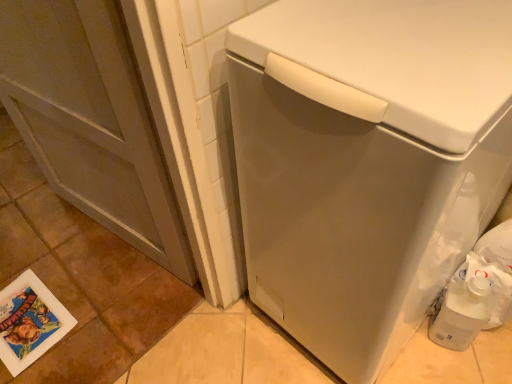
What do you see at coordinates (476, 292) in the screenshot? I see `white plastic jug at lower right` at bounding box center [476, 292].

Describe the element at coordinates (30, 321) in the screenshot. Image resolution: width=512 pixels, height=384 pixels. I see `printed paper postcard at lower left` at that location.

Describe the element at coordinates (90, 120) in the screenshot. I see `matte gray screen door at left` at that location.

Identify the location of white plastic jug at lower right. (476, 292).

Which object is closer to the camera taking this photo, printed paper postcard at lower left or matte gray screen door at left?

matte gray screen door at left is more forward.

Is printed paper postcard at lower left looking in the opposite direction of matte gray screen door at left?

No, printed paper postcard at lower left is not facing the opposite direction of matte gray screen door at left.

In the scene shown: Is matte gray screen door at left inside printed paper postcard at lower left?

Actually, matte gray screen door at left is outside printed paper postcard at lower left.

Is printed paper postcard at lower left to the right of matte gray screen door at left from the viewer's perspective?

Incorrect, printed paper postcard at lower left is not on the right side of matte gray screen door at left.

From a real-world perspective, is printed paper postcard at lower left physically located above or below white plastic jug at lower right?

In terms of real-world spatial position, printed paper postcard at lower left is below white plastic jug at lower right.

Looking at this image, from the image's perspective, which object appears higher, printed paper postcard at lower left or white plastic jug at lower right?

white plastic jug at lower right appears higher in the image.

Is there a large distance between printed paper postcard at lower left and white plastic jug at lower right?

Yes, printed paper postcard at lower left and white plastic jug at lower right are quite far apart.

From a real-world perspective, is white plastic jug at lower right physically below matte gray screen door at left?

Indeed, from a real-world perspective, white plastic jug at lower right is positioned beneath matte gray screen door at left.

Is white plastic jug at lower right aimed at matte gray screen door at left?

No, white plastic jug at lower right is not facing towards matte gray screen door at left.

Considering the relative positions of white plastic jug at lower right and matte gray screen door at left in the image provided, is white plastic jug at lower right to the right of matte gray screen door at left from the viewer's perspective?

Yes, white plastic jug at lower right is to the right of matte gray screen door at left.

From a real-world perspective, is matte gray screen door at left on top of white matte washing machine at center?

No, from a real-world perspective, matte gray screen door at left is not over white matte washing machine at center

From the image's perspective, is matte gray screen door at left under white matte washing machine at center?

Incorrect, from the image's perspective, matte gray screen door at left is higher than white matte washing machine at center.

How many degrees apart are the facing directions of matte gray screen door at left and white matte washing machine at center?

The angular difference between matte gray screen door at left and white matte washing machine at center is 7.58 degrees.

From a real-world perspective, is white plastic jug at lower right physically located above or below printed paper postcard at lower left?

From a real-world perspective, white plastic jug at lower right is physically above printed paper postcard at lower left.

How many degrees apart are the facing directions of white plastic jug at lower right and printed paper postcard at lower left?

The facing directions of white plastic jug at lower right and printed paper postcard at lower left are 4.24 degrees apart.

In the image, is white plastic jug at lower right on the left side or the right side of printed paper postcard at lower left?

In the image, white plastic jug at lower right appears on the right side of printed paper postcard at lower left.

Can printed paper postcard at lower left be found inside white plastic jug at lower right?

Definitely not — printed paper postcard at lower left is not inside white plastic jug at lower right.

From a real-world perspective, is matte gray screen door at left located higher than white plastic jug at lower right?

Correct, in the physical world, matte gray screen door at left is higher than white plastic jug at lower right.

In the scene shown: Is matte gray screen door at left wider than white plastic jug at lower right?

Yes.

Is matte gray screen door at left in contact with white plastic jug at lower right?

They are not placed beside each other.

Looking at this image, between matte gray screen door at left and white plastic jug at lower right, which one appears on the right side from the viewer's perspective?

white plastic jug at lower right.

Which of these two, white matte washing machine at center or printed paper postcard at lower left, stands shorter?

Standing shorter between the two is printed paper postcard at lower left.

Does white matte washing machine at center appear on the right side of printed paper postcard at lower left?

Yes, white matte washing machine at center is to the right of printed paper postcard at lower left.

Is white matte washing machine at center facing towards printed paper postcard at lower left?

No.

Locate an element on the screen. This screenshot has width=512, height=384. screen door that is in front of the printed paper postcard at lower left is located at coordinates (90, 120).

At what (x,y) coordinates should I click in order to perform the action: click on garbage on the right of printed paper postcard at lower left. Please return your answer as a coordinate pair (x, y). The image size is (512, 384). Looking at the image, I should click on (476, 292).

Estimate the real-world distances between objects in this image. Which object is closer to matte gray screen door at left, white matte washing machine at center or printed paper postcard at lower left?

white matte washing machine at center.

Looking at the image, which one is located closer to white plastic jug at lower right, printed paper postcard at lower left or matte gray screen door at left?

Among the two, matte gray screen door at left is located nearer to white plastic jug at lower right.

From the image, which object appears to be nearer to white plastic jug at lower right, white matte washing machine at center or matte gray screen door at left?

The object closer to white plastic jug at lower right is white matte washing machine at center.

When comparing their distances from printed paper postcard at lower left, does matte gray screen door at left or white matte washing machine at center seem closer?

matte gray screen door at left is positioned closer to the anchor printed paper postcard at lower left.

Based on the photo, when comparing their distances from printed paper postcard at lower left, does matte gray screen door at left or white plastic jug at lower right seem closer?

matte gray screen door at left.

When comparing their distances from matte gray screen door at left, does printed paper postcard at lower left or white matte washing machine at center seem closer?

white matte washing machine at center is closer to matte gray screen door at left.

Which object lies nearer to the anchor point matte gray screen door at left, white matte washing machine at center or white plastic jug at lower right?

Based on the image, white matte washing machine at center appears to be nearer to matte gray screen door at left.

Estimate the real-world distances between objects in this image. Which object is closer to white matte washing machine at center, printed paper postcard at lower left or white plastic jug at lower right?

white plastic jug at lower right.

This screenshot has height=384, width=512. Identify the location of screen door between printed paper postcard at lower left and white matte washing machine at center from left to right. (90, 120).

You are a GUI agent. You are given a task and a screenshot of the screen. Output one action in this format:
    pyautogui.click(x=<x>, y=<y>)
    Task: Click on the washing machine situated between matte gray screen door at left and white plastic jug at lower right from left to right
    
    Given the screenshot: What is the action you would take?
    pyautogui.click(x=366, y=162)

Locate an element on the screen. The height and width of the screenshot is (384, 512). screen door situated between printed paper postcard at lower left and white plastic jug at lower right from left to right is located at coordinates (90, 120).

Find the location of a particular element. This screenshot has width=512, height=384. washing machine located between printed paper postcard at lower left and white plastic jug at lower right in the left-right direction is located at coordinates (366, 162).